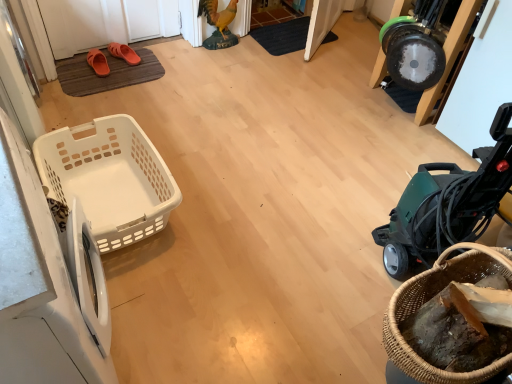
Identify the location of vacant area that lies between green plastic vacuum cleaner at right and white plastic basket at left, the first basket viewed from the back. (266, 237).